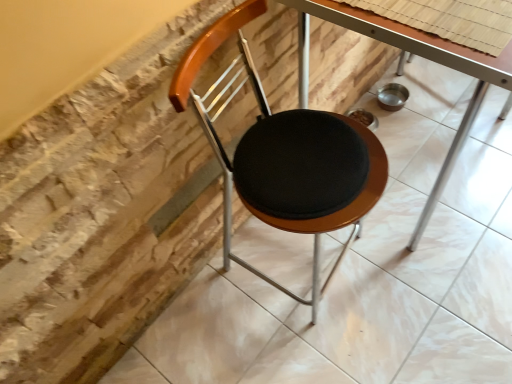
Identify the location of empty space that is in between matte black seat at center and metallic silver table at center. (385, 293).